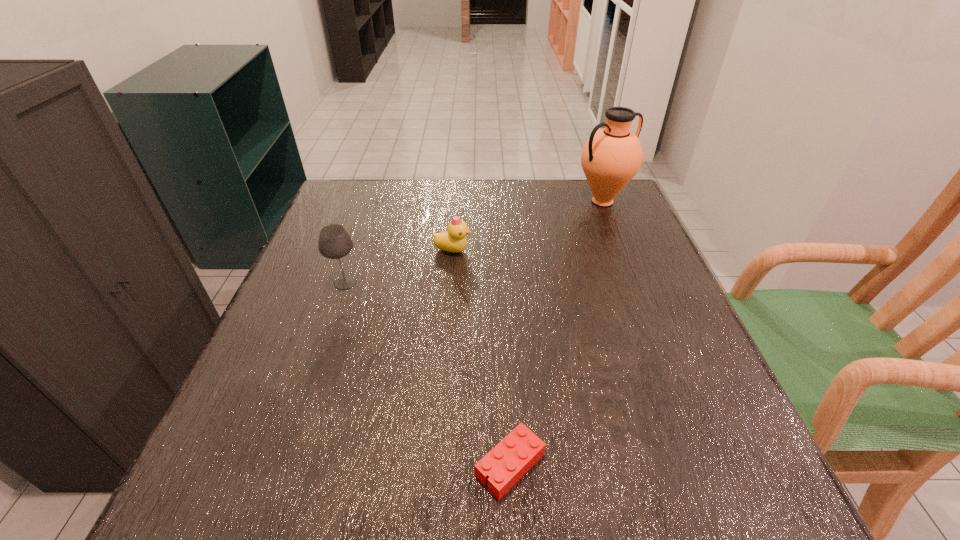
In order to click on vacant space positioned 0.330m on the front-facing side of the duckling in this screenshot , I will do `click(608, 251)`.

Find the location of a particular element. This screenshot has height=540, width=960. free space located 0.170m on the left of the nearest object is located at coordinates (362, 465).

Image resolution: width=960 pixels, height=540 pixels. Identify the location of object present at the far edge. (611, 157).

The height and width of the screenshot is (540, 960). I want to click on object located at the near edge, so click(x=515, y=455).

This screenshot has width=960, height=540. Find the location of `object present at the left edge`. object present at the left edge is located at coordinates (334, 242).

This screenshot has height=540, width=960. I want to click on object that is positioned at the right edge, so click(x=611, y=157).

You are a GUI agent. You are given a task and a screenshot of the screen. Output one action in this format:
    pyautogui.click(x=<x>, y=<y>)
    Task: Click on the object positioned at the far right corner
    
    Given the screenshot: What is the action you would take?
    pyautogui.click(x=611, y=157)

In the image, there is a desktop. Where is `free space at the far edge`? Image resolution: width=960 pixels, height=540 pixels. free space at the far edge is located at coordinates (456, 191).

The width and height of the screenshot is (960, 540). In the image, there is a desktop. Find the location of `vacant space at the left edge`. vacant space at the left edge is located at coordinates (362, 271).

At what (x,y) coordinates should I click in order to perform the action: click on vacant position at the right edge of the desktop. Please return your answer as a coordinate pair (x, y). This screenshot has width=960, height=540. Looking at the image, I should click on (652, 267).